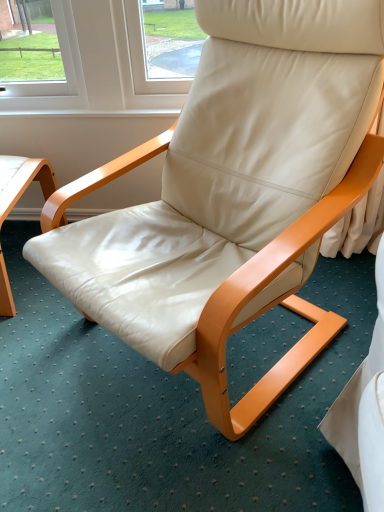
I want to click on light wood table at lower left, so coord(22,180).

Describe the element at coordinates (22, 180) in the screenshot. The width and height of the screenshot is (384, 512). I see `light wood table at lower left` at that location.

Where is `light wood table at lower left`? The height and width of the screenshot is (512, 384). light wood table at lower left is located at coordinates (22, 180).